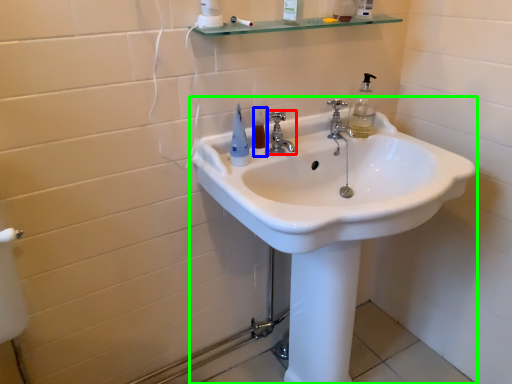
Question: Estimate the real-world distances between objects in this image. Which object is closer to tap (highlighted by a red box), mouthwash (highlighted by a blue box) or sink (highlighted by a green box)?

Choices:
 (A) mouthwash
 (B) sink

Answer: (A)